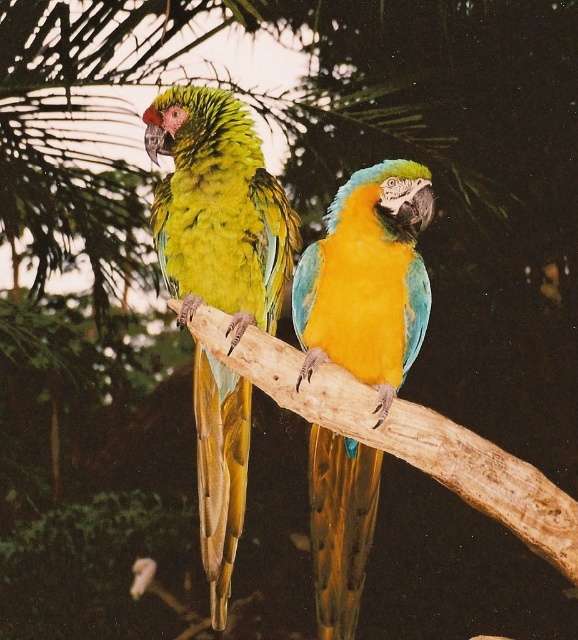
You are a birdwatcher trying to identify the parrots in the image. The green matte parrot at left is positioned at point (218, 209). Can you tell me the exact coordinates of the green matte parrot at left?

The green matte parrot at left is located at point (218, 209).